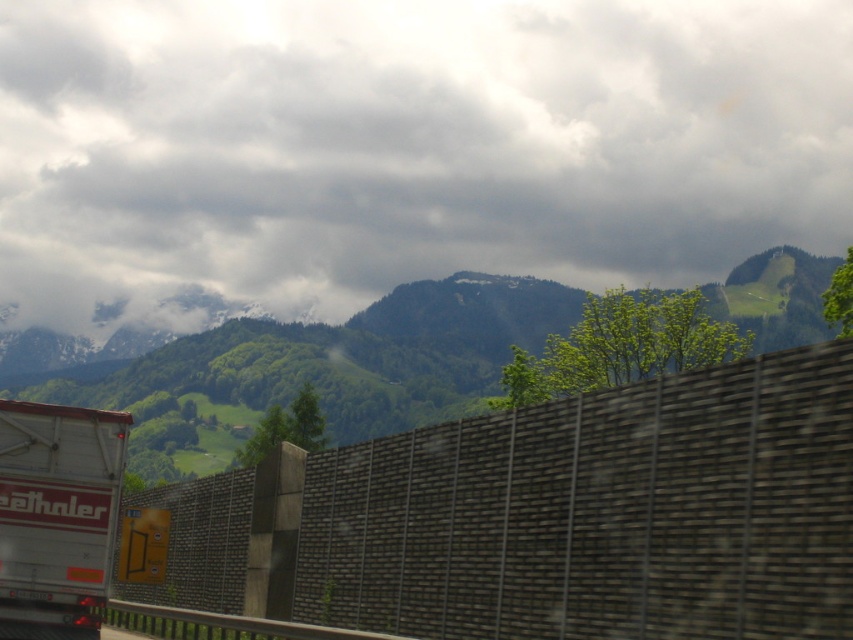
You are standing at the point marked as point (599, 513) on the dark gray concrete wall at center. Looking towards the truck on the left, which direction should you turn to face the mountain peaks with snow or ice?

You should turn to your right to face the mountain peaks with snow or ice because the truck is on the left side of the image, and the mountains are in the background opposite the wall.